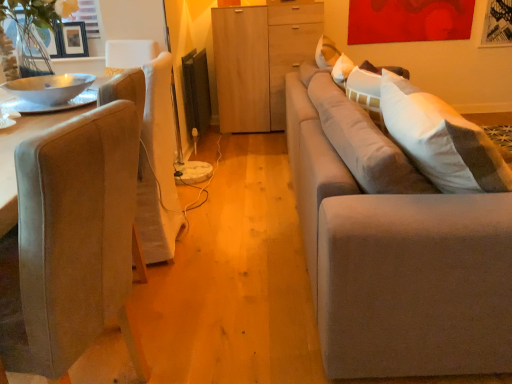
Question: Is suede gray couch at right wider or thinner than white glossy bowl at left?

Choices:
 (A) wide
 (B) thin

Answer: (A)

Question: Considering the positions of suede gray couch at right and white glossy bowl at left in the image, is suede gray couch at right bigger or smaller than white glossy bowl at left?

Choices:
 (A) big
 (B) small

Answer: (A)

Question: Estimate the real-world distances between objects in this image. Which object is closer to the matte black picture frame at upper left?

Choices:
 (A) suede gray couch at right
 (B) suede-like beige chair at left
 (C) light wood cabinet at center
 (D) white glossy bowl at left

Answer: (D)

Question: Based on their relative distances, which object is nearer to the suede gray couch at right?

Choices:
 (A) light wood cabinet at center
 (B) suede-like beige chair at left
 (C) matte black picture frame at upper left
 (D) white glossy bowl at left

Answer: (B)